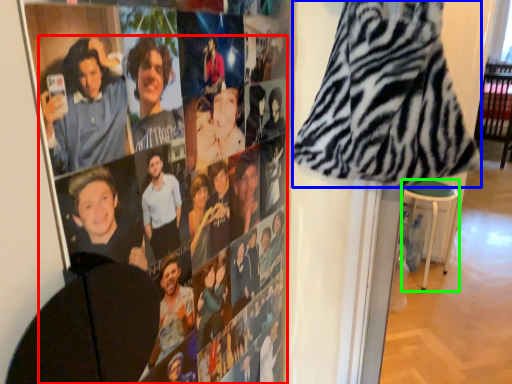
Question: Which object is positioned farthest from person (highlighted by a red box)? Select from blanket (highlighted by a blue box) and bar stool (highlighted by a green box).

Choices:
 (A) blanket
 (B) bar stool

Answer: (B)